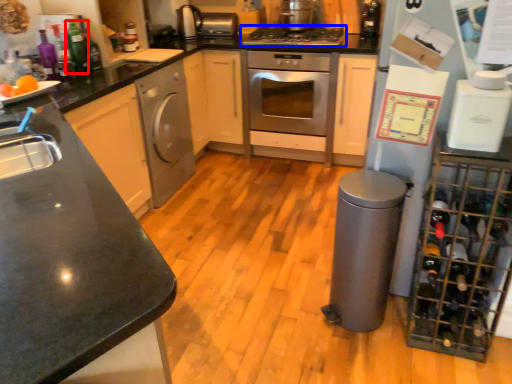
Question: Which object is further to the camera taking this photo, bottle (highlighted by a red box) or gas stove (highlighted by a blue box)?

Choices:
 (A) bottle
 (B) gas stove

Answer: (B)